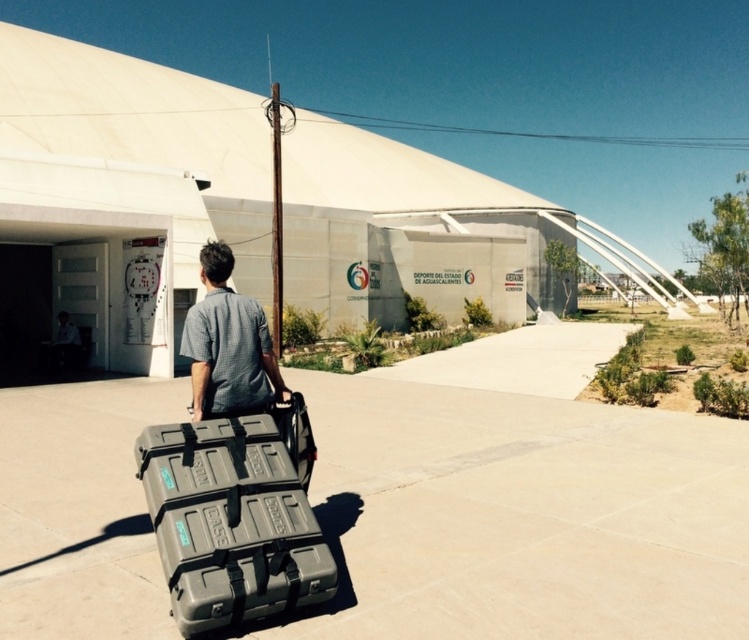
Describe the element at coordinates (231, 522) in the screenshot. I see `matte gray case at center` at that location.

Is point (178, 557) positioned behind point (234, 324)?

No, it is not.

Identify the location of matte gray case at center. (231, 522).